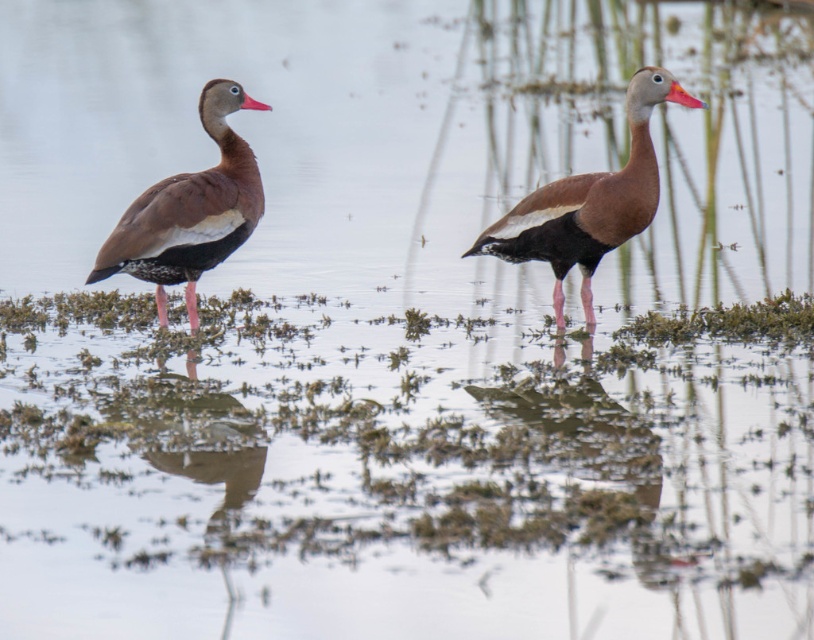
Question: Does brown matte duck at left have a greater width compared to brown matte duck at right?

Choices:
 (A) no
 (B) yes

Answer: (A)

Question: Does brown matte duck at left come behind brown matte duck at right?

Choices:
 (A) no
 (B) yes

Answer: (B)

Question: Considering the relative positions of brown matte duck at left and brown matte duck at right in the image provided, where is brown matte duck at left located with respect to brown matte duck at right?

Choices:
 (A) left
 (B) right

Answer: (A)

Question: Which point is farther from the camera taking this photo?

Choices:
 (A) (154, 268)
 (B) (627, 90)

Answer: (B)